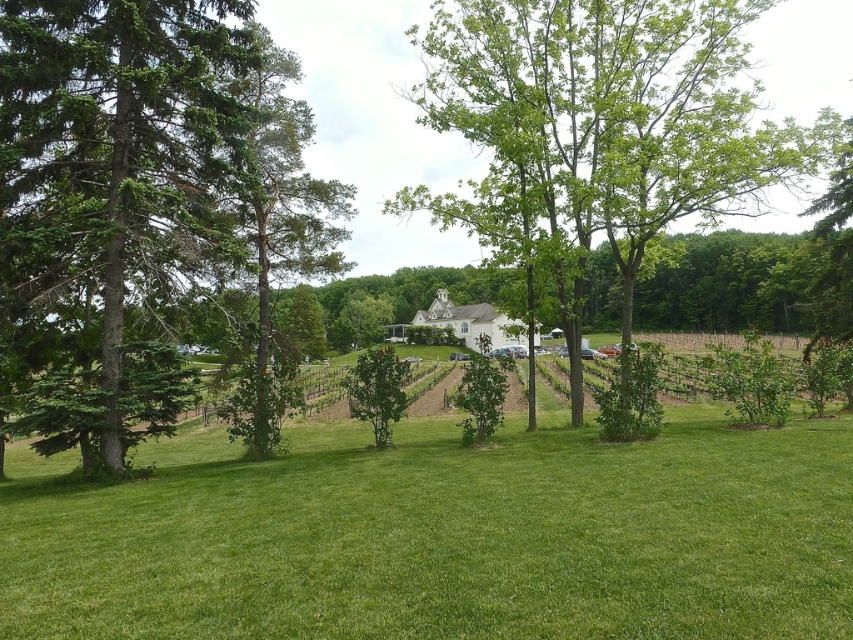
Consider the image. You are standing at the origin point of the image, which is located at coordinates 0,0. You want to walk to the green leafy tree at center. In which direction should you move?

You should move towards the coordinates (598,132) to reach the green leafy tree at center.

You are standing in the rural landscape and want to place a birdhouse between the green leafy tree at center and the green coniferous tree at left. Based on their positions, which tree should the birdhouse be closer to?

The green leafy tree at center is positioned over the green coniferous tree at left, so the birdhouse should be placed closer to the green coniferous tree at left since it is underneath the green leafy tree at center.

You are standing at the center of the image and want to find the green coniferous tree at left. In which direction should you look to locate it?

The green coniferous tree at left is located at point 0.223 on the x and 0.136 on the y, so you should look to the left direction to locate it.